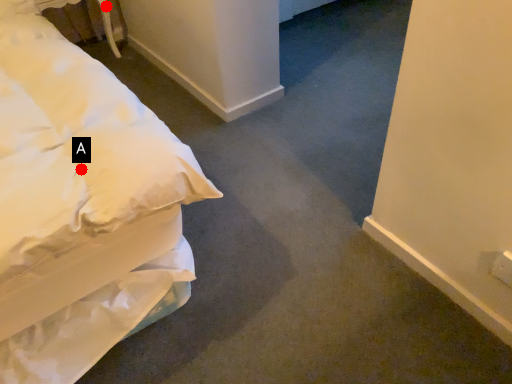
Question: Two points are circled on the image, labeled by A and B beside each circle. Which point is closer to the camera?

Choices:
 (A) A is closer
 (B) B is closer

Answer: (A)